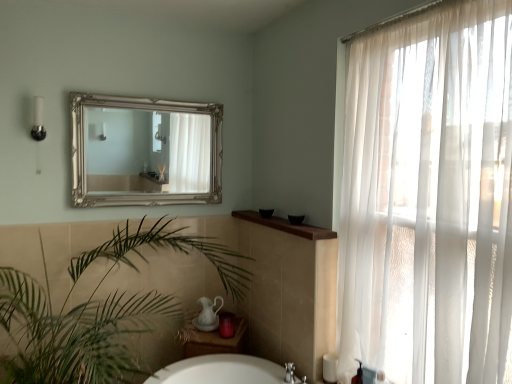
Question: Considering the relative sizes of silver ornate mirror at upper center and sheer white curtain at right in the image provided, is silver ornate mirror at upper center wider than sheer white curtain at right?

Choices:
 (A) no
 (B) yes

Answer: (A)

Question: From a real-world perspective, is silver ornate mirror at upper center on top of sheer white curtain at right?

Choices:
 (A) yes
 (B) no

Answer: (A)

Question: Is silver ornate mirror at upper center directly adjacent to sheer white curtain at right?

Choices:
 (A) no
 (B) yes

Answer: (A)

Question: Is silver ornate mirror at upper center thinner than sheer white curtain at right?

Choices:
 (A) yes
 (B) no

Answer: (A)

Question: Considering the relative positions of silver ornate mirror at upper center and sheer white curtain at right in the image provided, is silver ornate mirror at upper center in front of sheer white curtain at right?

Choices:
 (A) yes
 (B) no

Answer: (B)

Question: Is brown wood counter top at upper center inside the boundaries of black plastic soap dispenser at lower right, or outside?

Choices:
 (A) outside
 (B) inside

Answer: (A)

Question: From the image's perspective, is brown wood counter top at upper center located above or below black plastic soap dispenser at lower right?

Choices:
 (A) below
 (B) above

Answer: (B)

Question: From their relative heights in the image, would you say brown wood counter top at upper center is taller or shorter than black plastic soap dispenser at lower right?

Choices:
 (A) short
 (B) tall

Answer: (A)

Question: Based on their sizes in the image, would you say brown wood counter top at upper center is bigger or smaller than black plastic soap dispenser at lower right?

Choices:
 (A) big
 (B) small

Answer: (A)

Question: Is green leafy plant at lower left to the left or to the right of brown wood counter top at upper center in the image?

Choices:
 (A) right
 (B) left

Answer: (B)

Question: Is green leafy plant at lower left bigger or smaller than brown wood counter top at upper center?

Choices:
 (A) big
 (B) small

Answer: (A)

Question: Choose the correct answer: Is green leafy plant at lower left inside brown wood counter top at upper center or outside it?

Choices:
 (A) outside
 (B) inside

Answer: (A)

Question: Does point (144, 314) appear closer or farther from the camera than point (286, 226)?

Choices:
 (A) farther
 (B) closer

Answer: (A)

Question: Looking at the image, does green leafy plant at lower left seem bigger or smaller compared to silver ornate mirror at upper center?

Choices:
 (A) small
 (B) big

Answer: (B)

Question: Considering the positions of green leafy plant at lower left and silver ornate mirror at upper center in the image, is green leafy plant at lower left wider or thinner than silver ornate mirror at upper center?

Choices:
 (A) thin
 (B) wide

Answer: (B)